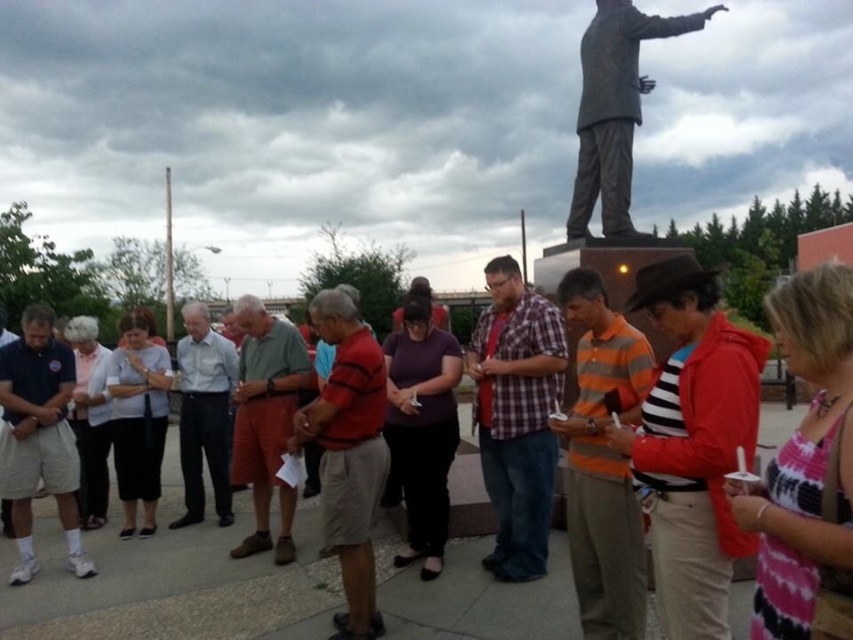
Question: Which object appears closest to the camera in this image?

Choices:
 (A) striped cotton shirt at center
 (B) matte red shirt at center
 (C) white cotton shorts at left
 (D) green cotton shirt at center

Answer: (A)

Question: Can you confirm if matte red shirt at center is wider than bronze statue at upper right?

Choices:
 (A) yes
 (B) no

Answer: (B)

Question: Which of the following is the closest to the observer?

Choices:
 (A) matte red shirt at center
 (B) light blue shirt at center
 (C) white cotton shorts at left

Answer: (A)

Question: Does matte red shirt at center lie in front of red striped shirt at center?

Choices:
 (A) yes
 (B) no

Answer: (B)

Question: Does white cotton shorts at left appear under green cotton shirt at center?

Choices:
 (A) yes
 (B) no

Answer: (A)

Question: Which of the following is the farthest from the observer?

Choices:
 (A) (195, 579)
 (B) (581, 83)

Answer: (B)